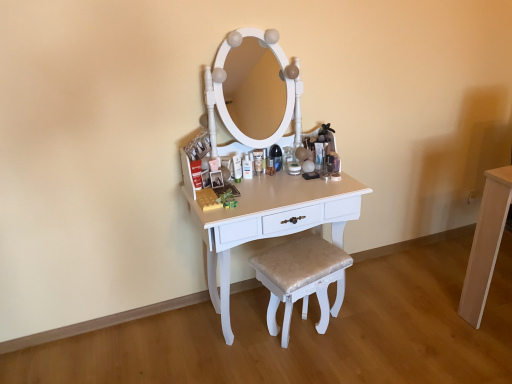
The width and height of the screenshot is (512, 384). What do you see at coordinates (269, 221) in the screenshot?
I see `white glossy table at center, the 2th table in the right-to-left sequence` at bounding box center [269, 221].

Identify the location of white glossy table at center, the 2th table in the right-to-left sequence. This screenshot has width=512, height=384. (269, 221).

Which is in front, point (213, 250) or point (236, 180)?

The point (213, 250) is more forward.

From a real-world perspective, between white glossy table at center, the 2th table in the right-to-left sequence, and matte white lotion at center, who is vertically lower?

From a 3D spatial view, white glossy table at center, the 2th table in the right-to-left sequence, is below.

Based on the photo, how many degrees apart are the facing directions of white glossy table at center, the 2th table in the right-to-left sequence, and matte white lotion at center?

The angle between the facing direction of white glossy table at center, the 2th table in the right-to-left sequence, and the facing direction of matte white lotion at center is 1.73 degrees.

Who is shorter, white glossy table at center, which appears as the 1th table when viewed from the left, or matte white lotion at center?

matte white lotion at center is shorter.

Is white glossy table at center, the 2th table in the right-to-left sequence, aimed at light wood cabinet at right, the 1th table when ordered from right to left?

No, white glossy table at center, the 2th table in the right-to-left sequence, does not turn towards light wood cabinet at right, the 1th table when ordered from right to left.

In order to click on table above the white glossy table at center, the 2th table in the right-to-left sequence (from a real-world perspective) in this screenshot , I will do `click(486, 243)`.

Is white glossy table at center, the 2th table in the right-to-left sequence, with light wood cabinet at right, the 1th table when ordered from right to left?

There is a gap between white glossy table at center, the 2th table in the right-to-left sequence, and light wood cabinet at right, the 1th table when ordered from right to left.

How different are the orientations of white glossy table at center, which appears as the 1th table when viewed from the left, and light wood cabinet at right, the 1th table when ordered from right to left, in degrees?

The facing directions of white glossy table at center, which appears as the 1th table when viewed from the left, and light wood cabinet at right, the 1th table when ordered from right to left, are 4.94 degrees apart.

Does matte white lotion at center have a greater width compared to shiny beige cushioned stool at center?

No.

Can you tell me how much matte white lotion at center and shiny beige cushioned stool at center differ in facing direction?

The angular difference between matte white lotion at center and shiny beige cushioned stool at center is 16.1 degrees.

Would you say matte white lotion at center contains shiny beige cushioned stool at center?

No, shiny beige cushioned stool at center is not a part of matte white lotion at center.

Is matte white lotion at center aimed at shiny beige cushioned stool at center?

No, matte white lotion at center is not aimed at shiny beige cushioned stool at center.

Is matte white lotion at center oriented towards light wood cabinet at right, the 2th table when ordered from left to right?

No, matte white lotion at center is not turned towards light wood cabinet at right, the 2th table when ordered from left to right.

Is the depth of matte white lotion at center greater than that of light wood cabinet at right, the 2th table when ordered from left to right?

Yes.

From a real-world perspective, between matte white lotion at center and light wood cabinet at right, the 2th table when ordered from left to right, who is vertically lower?

light wood cabinet at right, the 2th table when ordered from left to right.

Measure the distance between matte white lotion at center and light wood cabinet at right, the 2th table when ordered from left to right.

The distance of matte white lotion at center from light wood cabinet at right, the 2th table when ordered from left to right, is 1.15 meters.

From the image's perspective, between matte white lotion at center and white glossy table at center, the 2th table in the right-to-left sequence, who is located below?

From the image's view, white glossy table at center, the 2th table in the right-to-left sequence, is below.

Does matte white lotion at center have a lesser height compared to white glossy table at center, the 2th table in the right-to-left sequence?

Yes.

Is matte white lotion at center positioned with its back to white glossy table at center, which appears as the 1th table when viewed from the left?

matte white lotion at center is not turned away from white glossy table at center, which appears as the 1th table when viewed from the left.

From a real-world perspective, is matte white lotion at center positioned above or below white glossy table at center, the 2th table in the right-to-left sequence?

matte white lotion at center is situated higher than white glossy table at center, the 2th table in the right-to-left sequence, in the real world.

Is shiny beige cushioned stool at center not inside matte white lotion at center?

shiny beige cushioned stool at center is positioned outside matte white lotion at center.

Is shiny beige cushioned stool at center taller than matte white lotion at center?

Indeed, shiny beige cushioned stool at center has a greater height compared to matte white lotion at center.

Image resolution: width=512 pixels, height=384 pixels. Find the location of `toiletry located on the left of shiny beige cushioned stool at center`. toiletry located on the left of shiny beige cushioned stool at center is located at coordinates (237, 168).

Is point (326, 250) positioned before point (234, 179)?

Yes, it is in front of point (234, 179).

Which is behind, point (222, 255) or point (316, 270)?

The point (222, 255) is farther from the camera.

From the image's perspective, which object appears higher, white glossy table at center, the 2th table in the right-to-left sequence, or shiny beige cushioned stool at center?

white glossy table at center, the 2th table in the right-to-left sequence, appears higher in the image.

Between white glossy table at center, the 2th table in the right-to-left sequence, and shiny beige cushioned stool at center, which one has larger size?

white glossy table at center, the 2th table in the right-to-left sequence.

Relative to shiny beige cushioned stool at center, is white glossy table at center, the 2th table in the right-to-left sequence, in front or behind?

white glossy table at center, the 2th table in the right-to-left sequence, is positioned closer to the viewer than shiny beige cushioned stool at center.

Starting from the matte white lotion at center, which table is the 1st one to the right? Please provide its 2D coordinates.

[(269, 221)]

Locate an element on the screen. table on the left side of light wood cabinet at right, the 1th table when ordered from right to left is located at coordinates (269, 221).

Estimate the real-world distances between objects in this image. Which object is closer to shiny beige cushioned stool at center, light wood cabinet at right, the 2th table when ordered from left to right, or white glossy table at center, which appears as the 1th table when viewed from the left?

Among the two, white glossy table at center, which appears as the 1th table when viewed from the left, is located nearer to shiny beige cushioned stool at center.

Looking at the image, which one is located closer to shiny beige cushioned stool at center, white glossy table at center, the 2th table in the right-to-left sequence, or light wood cabinet at right, the 1th table when ordered from right to left?

white glossy table at center, the 2th table in the right-to-left sequence, is closer to shiny beige cushioned stool at center.

Looking at the image, which one is located closer to light wood cabinet at right, the 2th table when ordered from left to right, shiny beige cushioned stool at center or white glossy table at center, which appears as the 1th table when viewed from the left?

shiny beige cushioned stool at center is closer to light wood cabinet at right, the 2th table when ordered from left to right.

In the scene shown: Based on their spatial positions, is shiny beige cushioned stool at center or light wood cabinet at right, the 2th table when ordered from left to right, further from white glossy table at center, the 2th table in the right-to-left sequence?

Among the two, light wood cabinet at right, the 2th table when ordered from left to right, is located further to white glossy table at center, the 2th table in the right-to-left sequence.

From the image, which object appears to be nearer to white glossy table at center, which appears as the 1th table when viewed from the left, matte white lotion at center or shiny beige cushioned stool at center?

shiny beige cushioned stool at center lies closer to white glossy table at center, which appears as the 1th table when viewed from the left, than the other object.

Based on their spatial positions, is shiny beige cushioned stool at center or light wood cabinet at right, the 1th table when ordered from right to left, further from matte white lotion at center?

light wood cabinet at right, the 1th table when ordered from right to left.

Estimate the real-world distances between objects in this image. Which object is closer to matte white lotion at center, white glossy table at center, the 2th table in the right-to-left sequence, or shiny beige cushioned stool at center?

Among the two, white glossy table at center, the 2th table in the right-to-left sequence, is located nearer to matte white lotion at center.

Based on their spatial positions, is light wood cabinet at right, the 2th table when ordered from left to right, or matte white lotion at center closer to white glossy table at center, which appears as the 1th table when viewed from the left?

matte white lotion at center is closer to white glossy table at center, which appears as the 1th table when viewed from the left.

At what (x,y) coordinates should I click in order to perform the action: click on table situated between matte white lotion at center and light wood cabinet at right, the 2th table when ordered from left to right, from left to right. Please return your answer as a coordinate pair (x, y). The width and height of the screenshot is (512, 384). Looking at the image, I should click on (269, 221).

Find the location of a particular element. The height and width of the screenshot is (384, 512). stool located between white glossy table at center, the 2th table in the right-to-left sequence, and light wood cabinet at right, the 2th table when ordered from left to right, in the left-right direction is located at coordinates pyautogui.click(x=298, y=277).

Find the location of `stool between matte white lotion at center and light wood cabinet at right, the 1th table when ordered from right to left, from left to right`. stool between matte white lotion at center and light wood cabinet at right, the 1th table when ordered from right to left, from left to right is located at coordinates (298, 277).